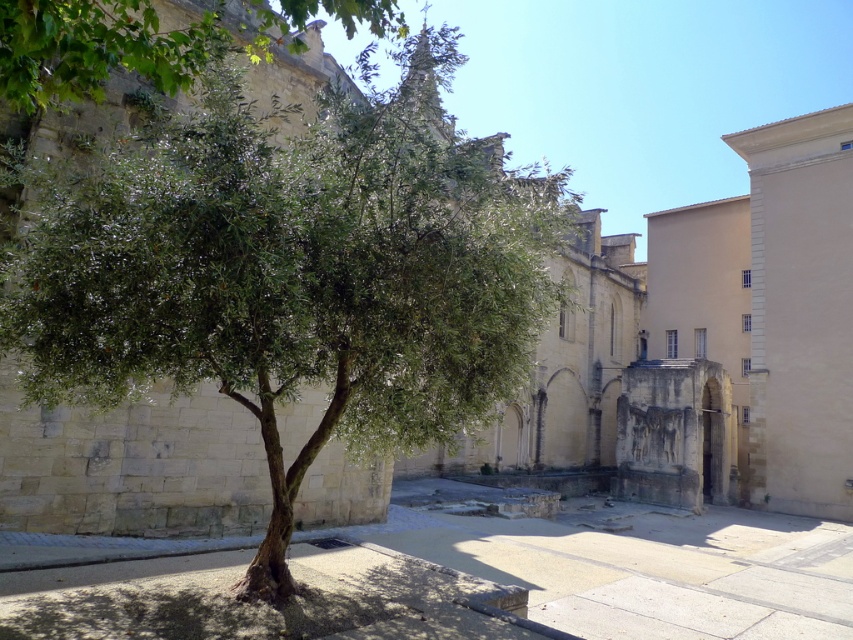
Question: Which point is farther to the camera?

Choices:
 (A) (527, 365)
 (B) (102, 13)
 (C) (824, 608)

Answer: (C)

Question: Does green leafy tree at left appear on the left side of smooth stone pavement at center?

Choices:
 (A) no
 (B) yes

Answer: (B)

Question: Which of these objects is positioned farthest from the green leafy tree at left?

Choices:
 (A) smooth stone pavement at center
 (B) green leafy tree at upper left

Answer: (A)

Question: From the image, what is the correct spatial relationship of smooth stone pavement at center in relation to green leafy tree at upper left?

Choices:
 (A) left
 (B) right

Answer: (B)

Question: Does green leafy tree at left have a lesser width compared to green leafy tree at upper left?

Choices:
 (A) no
 (B) yes

Answer: (A)

Question: Which point is farther to the camera?

Choices:
 (A) green leafy tree at left
 (B) smooth stone pavement at center
 (C) green leafy tree at upper left

Answer: (B)